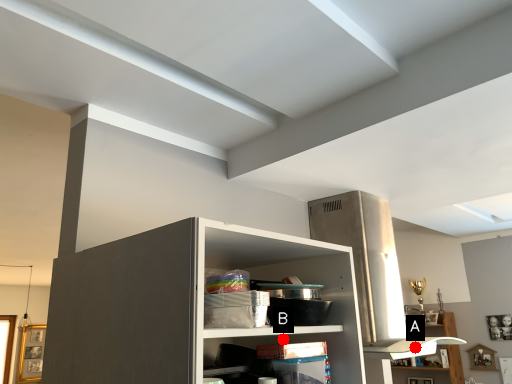
Question: Two points are circled on the image, labeled by A and B beside each circle. Among these points, which one is nearest to the camera?

Choices:
 (A) A is closer
 (B) B is closer

Answer: (B)